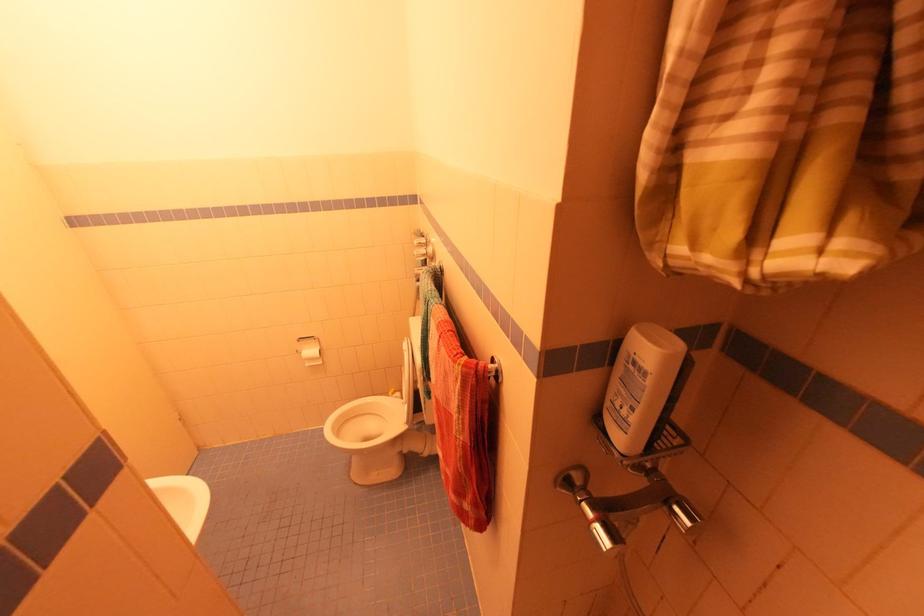
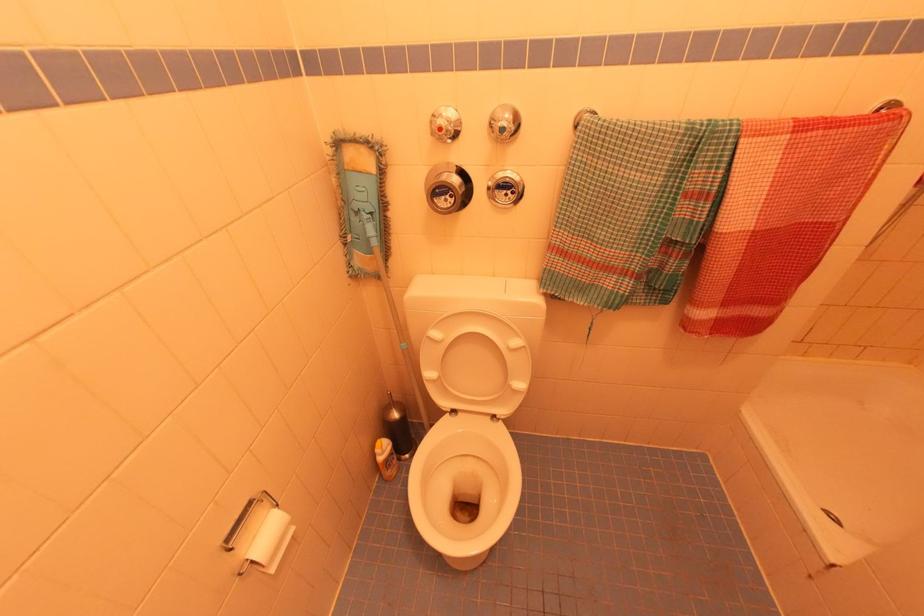
Locate, in the second image, the point that corresponds to the point at 396,395 in the first image.

(385, 448)